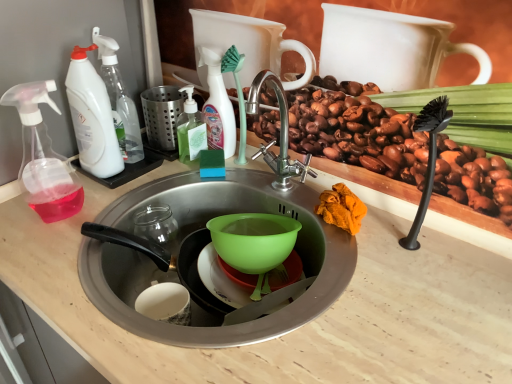
What are the coordinates of `matte stainless steel sink at center` in the screenshot? It's located at (200, 249).

What is the approximate height of matte stainless steel sink at center?

93.11 centimeters.

At what (x,y) coordinates should I click in order to perform the action: click on transparent plastic soap dispenser at left. Please return your answer as a coordinate pair (x, y). Image resolution: width=512 pixels, height=384 pixels. Looking at the image, I should click on (42, 156).

In order to face white plastic spray bottle at left, which is the 1th cleaning product from left to right, should I rotate leftwards or rightwards?

You should look left and rotate roughly 20.950 degrees.

I want to click on matte stainless steel sink at center, so click(200, 249).

In the scene shown: Based on their sizes in the image, would you say white plastic spray bottle at left, which ranks as the 3th cleaning product in right-to-left order, is bigger or smaller than translucent plastic spray bottle at upper center, which is counted as the 1th cleaning product, starting from the right?

In the image, white plastic spray bottle at left, which ranks as the 3th cleaning product in right-to-left order, appears to be larger than translucent plastic spray bottle at upper center, which is counted as the 1th cleaning product, starting from the right.

In the image, is white plastic spray bottle at left, which is the 1th cleaning product from left to right, on the left side or the right side of translucent plastic spray bottle at upper center, which is counted as the 1th cleaning product, starting from the right?

In the image, white plastic spray bottle at left, which is the 1th cleaning product from left to right, appears on the left side of translucent plastic spray bottle at upper center, which is counted as the 1th cleaning product, starting from the right.

Between white plastic spray bottle at left, which ranks as the 3th cleaning product in right-to-left order, and translucent plastic spray bottle at upper center, the third cleaning product positioned from the left, which one has more height?

Standing taller between the two is white plastic spray bottle at left, which ranks as the 3th cleaning product in right-to-left order.

Which is less distant, (58,214) or (242,55)?

The point (58,214) is more forward.

Which is behind, transparent plastic soap dispenser at left or green plastic brush at upper center?

green plastic brush at upper center is behind.

Would you say green plastic brush at upper center is part of transparent plastic soap dispenser at left's contents?

Definitely not — green plastic brush at upper center is not inside transparent plastic soap dispenser at left.

Considering the relative sizes of transparent plastic soap dispenser at left and green plastic brush at upper center in the image provided, is transparent plastic soap dispenser at left wider than green plastic brush at upper center?

Indeed, transparent plastic soap dispenser at left has a greater width compared to green plastic brush at upper center.

This screenshot has width=512, height=384. What are the coordinates of `sink on the right of white plastic spray bottle at left, the 2th cleaning product in the right-to-left sequence` in the screenshot? It's located at (200, 249).

Is there a large distance between matte stainless steel sink at center and white plastic spray bottle at left, placed as the 2th cleaning product when sorted from left to right?

They are positioned close to each other.

Considering the sizes of objects matte stainless steel sink at center and white plastic spray bottle at left, placed as the 2th cleaning product when sorted from left to right, in the image provided, who is taller, matte stainless steel sink at center or white plastic spray bottle at left, placed as the 2th cleaning product when sorted from left to right,?

With more height is matte stainless steel sink at center.

Can you confirm if matte stainless steel sink at center is positioned to the left of white plastic spray bottle at left, placed as the 2th cleaning product when sorted from left to right?

No.

Looking at this image, from the image's perspective, would you say white plastic spray bottle at left, the 2th cleaning product in the right-to-left sequence, is shown under green plastic brush at upper center?

No.

Considering their positions, is white plastic spray bottle at left, placed as the 2th cleaning product when sorted from left to right, located in front of or behind green plastic brush at upper center?

white plastic spray bottle at left, placed as the 2th cleaning product when sorted from left to right, is positioned closer to the viewer than green plastic brush at upper center.

This screenshot has height=384, width=512. Identify the location of brush to the right of white plastic spray bottle at left, the 2th cleaning product in the right-to-left sequence. (238, 95).

Is white plastic spray bottle at left, the 2th cleaning product in the right-to-left sequence, inside the boundaries of green plastic brush at upper center, or outside?

white plastic spray bottle at left, the 2th cleaning product in the right-to-left sequence, exists outside the volume of green plastic brush at upper center.

Measure the distance between translucent plastic spray bottle at upper center, which is counted as the 1th cleaning product, starting from the right, and green translucent soap dispenser at center.

A distance of 2.10 inches exists between translucent plastic spray bottle at upper center, which is counted as the 1th cleaning product, starting from the right, and green translucent soap dispenser at center.

Locate an element on the screen. Image resolution: width=512 pixels, height=384 pixels. the 1st cleaning product directly above the green translucent soap dispenser at center (from a real-world perspective) is located at coordinates (217, 104).

Between translucent plastic spray bottle at upper center, the third cleaning product positioned from the left, and green translucent soap dispenser at center, which one is positioned in front?

Positioned in front is translucent plastic spray bottle at upper center, the third cleaning product positioned from the left.

Is green translucent soap dispenser at center next to translucent plastic spray bottle at upper center, the third cleaning product positioned from the left?

Yes.

Considering the positions of points (189, 159) and (214, 55), is point (189, 159) farther from camera compared to point (214, 55)?

Yes, point (189, 159) is farther from viewer.

Considering the relative sizes of green translucent soap dispenser at center and translucent plastic spray bottle at upper center, the third cleaning product positioned from the left, in the image provided, is green translucent soap dispenser at center bigger than translucent plastic spray bottle at upper center, the third cleaning product positioned from the left,?

Incorrect, green translucent soap dispenser at center is not larger than translucent plastic spray bottle at upper center, the third cleaning product positioned from the left.

Based on the photo, can you confirm if green translucent soap dispenser at center is shorter than translucent plastic spray bottle at upper center, which is counted as the 1th cleaning product, starting from the right?

Yes.

Is translucent plastic spray bottle at upper center, which is counted as the 1th cleaning product, starting from the right, touching green plastic brush at upper center?

Yes, translucent plastic spray bottle at upper center, which is counted as the 1th cleaning product, starting from the right, is beside green plastic brush at upper center.

From the image's perspective, is translucent plastic spray bottle at upper center, which is counted as the 1th cleaning product, starting from the right, positioned above or below green plastic brush at upper center?

From the image's perspective, translucent plastic spray bottle at upper center, which is counted as the 1th cleaning product, starting from the right, appears above green plastic brush at upper center.

Which of these two, translucent plastic spray bottle at upper center, the third cleaning product positioned from the left, or green plastic brush at upper center, stands shorter?

With less height is translucent plastic spray bottle at upper center, the third cleaning product positioned from the left.

From the picture: Which point is more forward, (217, 57) or (240, 156)?

The point (217, 57) is more forward.

This screenshot has height=384, width=512. In order to click on cleaning product that is the 2nd object located in front of the translucent plastic spray bottle at upper center, which is counted as the 1th cleaning product, starting from the right in this screenshot , I will do `click(92, 117)`.

Find the location of a particular element. soap dispenser lying below the green plastic brush at upper center (from the image's perspective) is located at coordinates (42, 156).

Considering their positions, is white plastic spray bottle at left, which is the 1th cleaning product from left to right, positioned closer to matte stainless steel sink at center than translucent plastic spray bottle at upper center, the third cleaning product positioned from the left?

translucent plastic spray bottle at upper center, the third cleaning product positioned from the left.

Considering their positions, is green translucent soap dispenser at center positioned further to green plastic brush at upper center than white plastic spray bottle at left, the 2th cleaning product in the right-to-left sequence?

Based on the image, white plastic spray bottle at left, the 2th cleaning product in the right-to-left sequence, appears to be further to green plastic brush at upper center.

Looking at this image, from the image, which object appears to be nearer to green translucent soap dispenser at center, white plastic spray bottle at left, the 2th cleaning product in the right-to-left sequence, or matte stainless steel sink at center?

white plastic spray bottle at left, the 2th cleaning product in the right-to-left sequence.

Based on their spatial positions, is matte stainless steel sink at center or white plastic spray bottle at left, the 2th cleaning product in the right-to-left sequence, closer to white plastic spray bottle at left, which ranks as the 3th cleaning product in right-to-left order?

white plastic spray bottle at left, the 2th cleaning product in the right-to-left sequence, lies closer to white plastic spray bottle at left, which ranks as the 3th cleaning product in right-to-left order, than the other object.

Based on their spatial positions, is transparent plastic soap dispenser at left or white plastic spray bottle at left, which is the 1th cleaning product from left to right, closer to translucent plastic spray bottle at upper center, the third cleaning product positioned from the left?

white plastic spray bottle at left, which is the 1th cleaning product from left to right, is closer to translucent plastic spray bottle at upper center, the third cleaning product positioned from the left.

When comparing their distances from white plastic spray bottle at left, which is the 1th cleaning product from left to right, does green translucent soap dispenser at center or matte stainless steel sink at center seem closer?

green translucent soap dispenser at center.

From the image, which object appears to be nearer to white plastic spray bottle at left, the 2th cleaning product in the right-to-left sequence, green plastic brush at upper center or transparent plastic soap dispenser at left?

Based on the image, transparent plastic soap dispenser at left appears to be nearer to white plastic spray bottle at left, the 2th cleaning product in the right-to-left sequence.

Estimate the real-world distances between objects in this image. Which object is further from green translucent soap dispenser at center, matte stainless steel sink at center or green plastic brush at upper center?

Among the two, matte stainless steel sink at center is located further to green translucent soap dispenser at center.

At what (x,y) coordinates should I click in order to perform the action: click on brush between white plastic spray bottle at left, the 2th cleaning product in the right-to-left sequence, and matte stainless steel sink at center, in the vertical direction. Please return your answer as a coordinate pair (x, y). The image size is (512, 384). Looking at the image, I should click on (238, 95).

Identify the location of bottle between transparent plastic soap dispenser at left and green plastic brush at upper center. Image resolution: width=512 pixels, height=384 pixels. (190, 129).

Where is `soap dispenser that lies between translucent plastic spray bottle at upper center, which is counted as the 1th cleaning product, starting from the right, and matte stainless steel sink at center from top to bottom`? The height and width of the screenshot is (384, 512). soap dispenser that lies between translucent plastic spray bottle at upper center, which is counted as the 1th cleaning product, starting from the right, and matte stainless steel sink at center from top to bottom is located at coordinates (42, 156).

The height and width of the screenshot is (384, 512). Find the location of `cleaning product between white plastic spray bottle at left, which is the 1th cleaning product from left to right, and green translucent soap dispenser at center, in the horizontal direction`. cleaning product between white plastic spray bottle at left, which is the 1th cleaning product from left to right, and green translucent soap dispenser at center, in the horizontal direction is located at coordinates (119, 99).